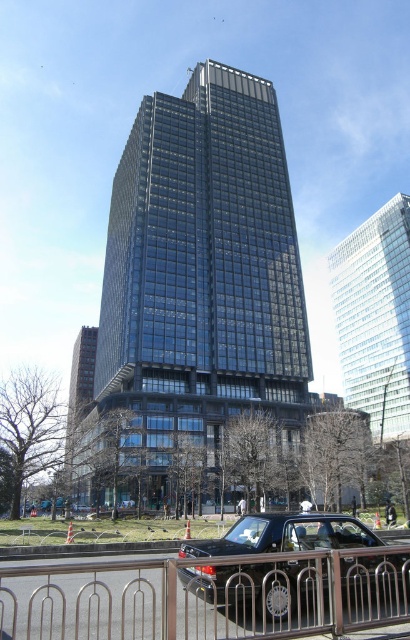
Can you confirm if glassy black skyscraper at center is shorter than shiny black car at center?

Incorrect, glassy black skyscraper at center's height does not fall short of shiny black car at center's.

Is point (123, 221) closer to viewer compared to point (343, 529)?

No, it is behind (343, 529).

Describe the element at coordinates (202, 269) in the screenshot. I see `glassy black skyscraper at center` at that location.

Locate an element on the screen. glassy black skyscraper at center is located at coordinates (202, 269).

Is stainless steel fence at lower center to the right of shiny black car at center from the viewer's perspective?

Incorrect, stainless steel fence at lower center is not on the right side of shiny black car at center.

Does stainless steel fence at lower center have a greater width compared to shiny black car at center?

Correct, the width of stainless steel fence at lower center exceeds that of shiny black car at center.

What do you see at coordinates (205, 596) in the screenshot? This screenshot has height=640, width=410. I see `stainless steel fence at lower center` at bounding box center [205, 596].

This screenshot has width=410, height=640. Identify the location of stainless steel fence at lower center. (205, 596).

Where is `clear glass skyscraper at upper center`? clear glass skyscraper at upper center is located at coordinates (375, 316).

Can you confirm if clear glass skyscraper at upper center is positioned to the right of shiny black car at center?

Indeed, clear glass skyscraper at upper center is positioned on the right side of shiny black car at center.

Who is more forward, (375, 400) or (378, 561)?

Point (378, 561)

Find the location of `clear glass skyscraper at upper center`. clear glass skyscraper at upper center is located at coordinates (375, 316).